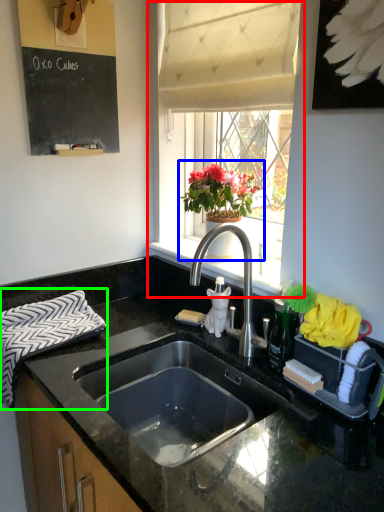
Question: Based on their relative distances, which object is nearer to window (highlighted by a red box)? Choose from houseplant (highlighted by a blue box) and hand towel (highlighted by a green box).

Choices:
 (A) houseplant
 (B) hand towel

Answer: (A)